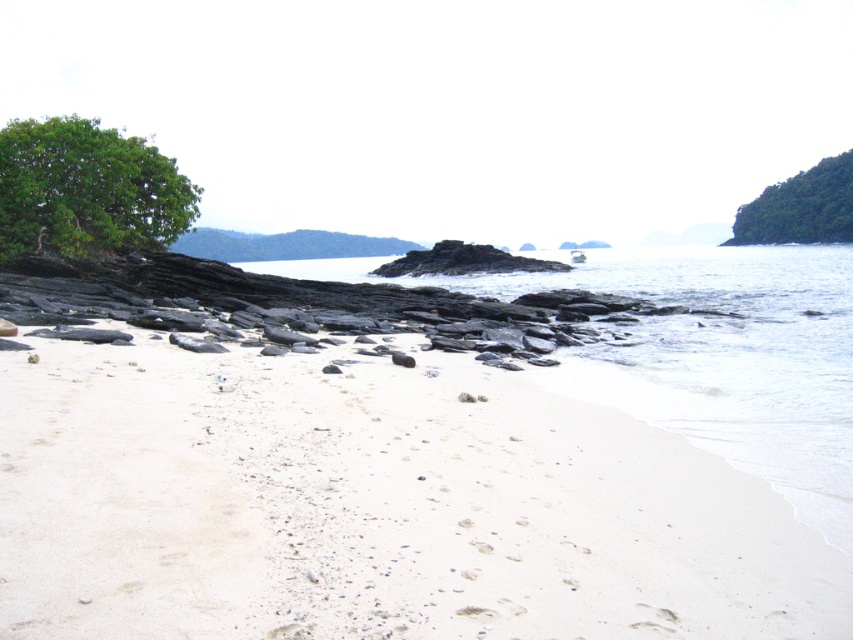
Can you confirm if white sandy beach at lower left is thinner than green leafy tree at upper right?

Yes.

Which is behind, point (253, 630) or point (741, 234)?

Point (741, 234)

Locate an element on the screen. Image resolution: width=853 pixels, height=640 pixels. white sandy beach at lower left is located at coordinates tap(374, 506).

Is white sandy beach at lower left below green leafy tree at upper left?

Correct, white sandy beach at lower left is located below green leafy tree at upper left.

Who is higher up, white sandy beach at lower left or green leafy tree at upper left?

green leafy tree at upper left is higher up.

Does point (354, 525) lie behind point (91, 243)?

No.

Where is `white sandy beach at lower left`? The image size is (853, 640). white sandy beach at lower left is located at coordinates coord(374,506).

Is point (79, 136) in front of point (772, 228)?

Yes, it is in front of point (772, 228).

Who is positioned more to the right, green leafy tree at upper left or green leafy tree at upper right?

green leafy tree at upper right

Which is in front, point (149, 156) or point (839, 214)?

Positioned in front is point (149, 156).

Find the location of a particular element. Image resolution: width=853 pixels, height=640 pixels. green leafy tree at upper left is located at coordinates (86, 189).